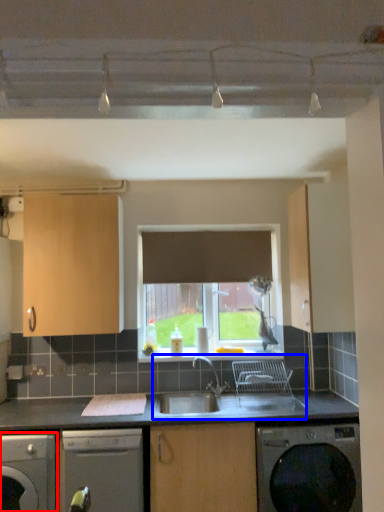
Question: Which point is closer to the camera, dishwasher (highlighted by a red box) or sink (highlighted by a blue box)?

Choices:
 (A) dishwasher
 (B) sink

Answer: (A)